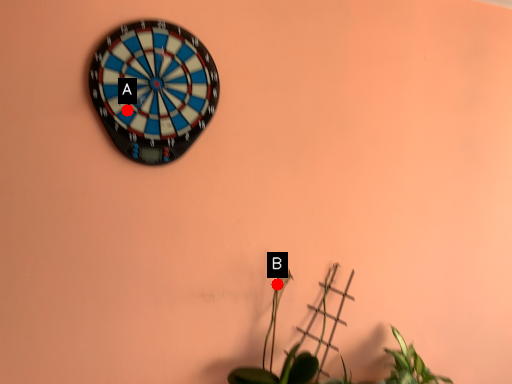
Question: Two points are circled on the image, labeled by A and B beside each circle. Which point is farther to the camera?

Choices:
 (A) A is further
 (B) B is further

Answer: (B)